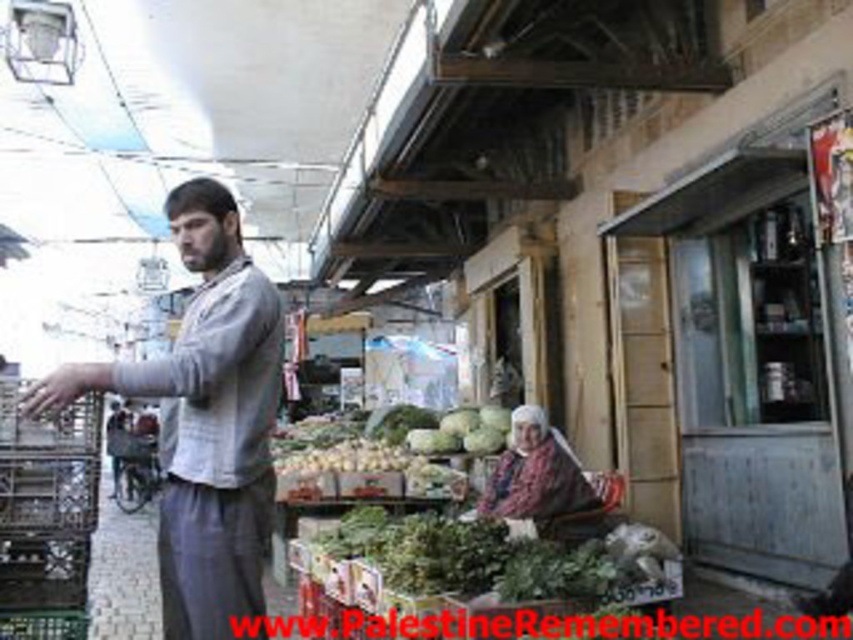
Question: Is floral fabric headscarf at center closer to the viewer compared to green matte cabbage at center?

Choices:
 (A) no
 (B) yes

Answer: (B)

Question: Which object is positioned farthest from the green matte cabbage at center?

Choices:
 (A) gray cotton shirt at center
 (B) floral fabric headscarf at center

Answer: (A)

Question: Can you confirm if gray cotton shirt at center is positioned below floral fabric headscarf at center?

Choices:
 (A) no
 (B) yes

Answer: (A)

Question: Which object is closer to the camera taking this photo?

Choices:
 (A) floral fabric headscarf at center
 (B) gray cotton shirt at center
 (C) green matte cabbage at center

Answer: (B)

Question: Which point is farther from the camera taking this photo?

Choices:
 (A) (544, 508)
 (B) (15, 380)

Answer: (A)

Question: From the image, what is the correct spatial relationship of gray cotton shirt at center in relation to brown plastic crate at left?

Choices:
 (A) below
 (B) above

Answer: (B)